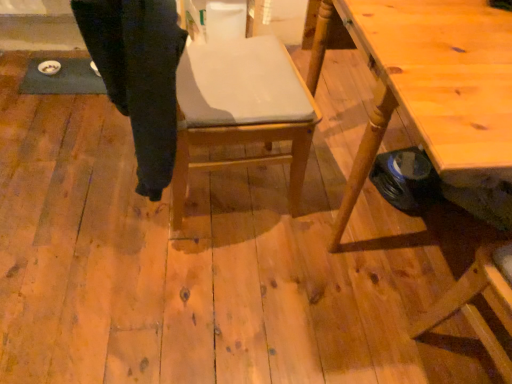
Question: Is wooden chair at center positioned with its back to wooden table at right?

Choices:
 (A) yes
 (B) no

Answer: (B)

Question: Does wooden chair at center have a greater height compared to wooden table at right?

Choices:
 (A) no
 (B) yes

Answer: (B)

Question: Is wooden chair at center thinner than wooden table at right?

Choices:
 (A) no
 (B) yes

Answer: (B)

Question: Is wooden chair at center not near wooden table at right?

Choices:
 (A) no
 (B) yes

Answer: (A)

Question: Is wooden chair at center next to wooden table at right and touching it?

Choices:
 (A) yes
 (B) no

Answer: (B)

Question: Based on their positions, is wooden chair at center located to the left or right of black cotton trousers at center?

Choices:
 (A) left
 (B) right

Answer: (B)

Question: From a real-world perspective, is wooden chair at center physically located above or below black cotton trousers at center?

Choices:
 (A) below
 (B) above

Answer: (A)

Question: Considering the positions of wooden chair at center and black cotton trousers at center in the image, is wooden chair at center taller or shorter than black cotton trousers at center?

Choices:
 (A) tall
 (B) short

Answer: (A)

Question: Would you say wooden chair at center is inside or outside black cotton trousers at center?

Choices:
 (A) outside
 (B) inside

Answer: (A)

Question: Is point (335, 218) positioned closer to the camera than point (155, 84)?

Choices:
 (A) closer
 (B) farther

Answer: (B)

Question: In the image, is wooden table at right positioned in front of or behind black cotton trousers at center?

Choices:
 (A) behind
 (B) front

Answer: (B)

Question: Considering the positions of wooden table at right and black cotton trousers at center in the image, is wooden table at right taller or shorter than black cotton trousers at center?

Choices:
 (A) tall
 (B) short

Answer: (A)

Question: Based on their positions, is wooden table at right located to the left or right of black cotton trousers at center?

Choices:
 (A) left
 (B) right

Answer: (B)

Question: In the image, is wooden chair at center on the left side or the right side of wooden table at right?

Choices:
 (A) right
 (B) left

Answer: (B)

Question: Is wooden chair at center wider or thinner than wooden table at right?

Choices:
 (A) thin
 (B) wide

Answer: (A)